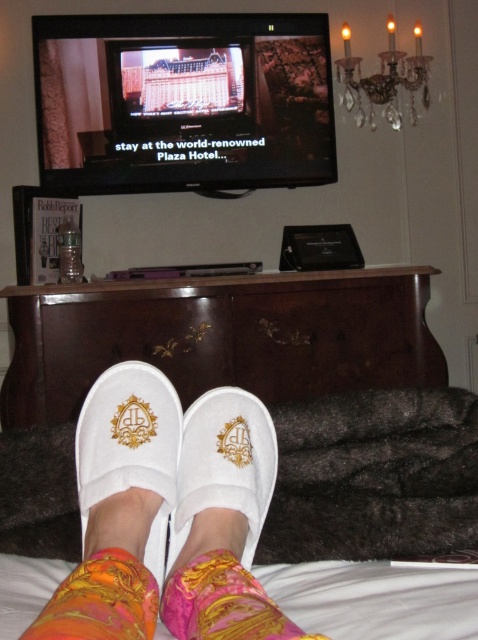
You are a hotel housekeeper standing at the entrance of the room. You need to retrieve the white fabric slipper at lower center to check its quality. Can you reach it without moving closer than 16 inches?

The white fabric slipper at lower center is 16.66 inches away from the viewer, so you can reach it without moving closer than 16 inches since the distance is slightly more than 16 inches.

You are a delivery person who needs to place a small package on the white wood dresser at center. You are currently standing 1.8 meters away from the dresser. Can you reach the dresser without moving closer?

The white wood dresser at center is 1.89 meters away from the viewer. Since you are 1.8 meters away, you are closer than the stated distance, so you can reach the dresser without moving closer.